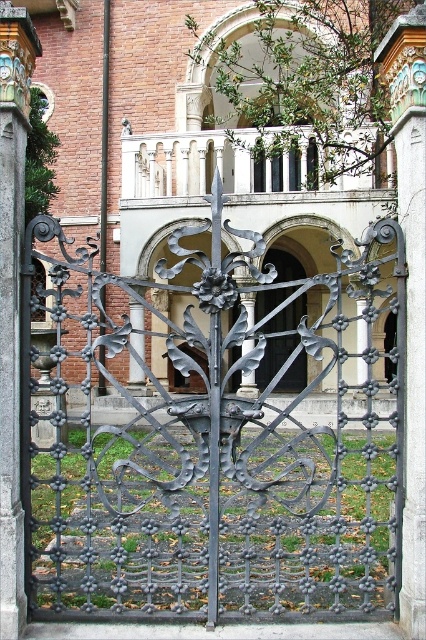
You are a delivery person with a cart that is 3 meters wide. You need to pass through the area between the black wrought iron gate at center and the gray stone pillar at right. Can your cart fit through the space between them?

The distance between the black wrought iron gate at center and the gray stone pillar at right is 8.36 meters. Since your cart is only 3 meters wide, it can easily fit through the space between them.